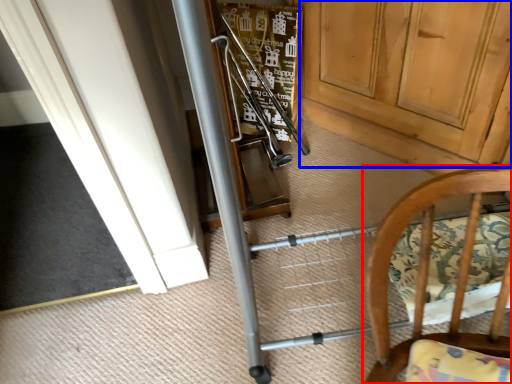
Question: Which point is closer to the camera, chair (highlighted by a red box) or door (highlighted by a blue box)?

Choices:
 (A) chair
 (B) door

Answer: (A)